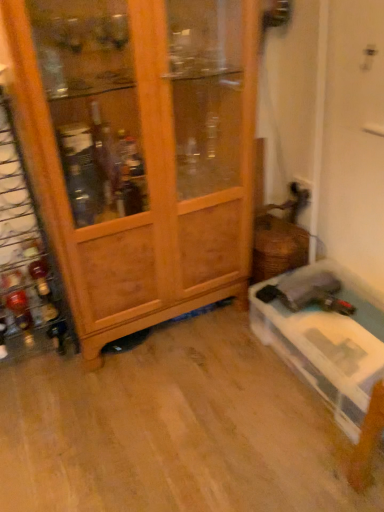
Question: Is wooden wine rack at left inside translucent glass bottle at left, the 1th bottle positioned from the bottom?

Choices:
 (A) no
 (B) yes

Answer: (A)

Question: Considering the relative sizes of translucent glass bottle at left, the 1th bottle positioned from the bottom, and wooden wine rack at left in the image provided, is translucent glass bottle at left, the 1th bottle positioned from the bottom, taller than wooden wine rack at left?

Choices:
 (A) no
 (B) yes

Answer: (A)

Question: From the image's perspective, is translucent glass bottle at left, the 1th bottle positioned from the bottom, under wooden wine rack at left?

Choices:
 (A) yes
 (B) no

Answer: (A)

Question: Is translucent glass bottle at left, the second bottle when ordered from top to bottom, oriented towards wooden wine rack at left?

Choices:
 (A) no
 (B) yes

Answer: (B)

Question: From a real-world perspective, is translucent glass bottle at left, the 1th bottle positioned from the bottom, beneath wooden wine rack at left?

Choices:
 (A) yes
 (B) no

Answer: (A)

Question: Does point (34, 246) appear closer or farther from the camera than point (4, 174)?

Choices:
 (A) farther
 (B) closer

Answer: (A)

Question: Is shiny amber glass bottle at left, which is the second bottle from bottom to top, in front of or behind wooden wine rack at left in the image?

Choices:
 (A) behind
 (B) front

Answer: (A)

Question: Looking at the image, does shiny amber glass bottle at left, which is the second bottle from bottom to top, seem bigger or smaller compared to wooden wine rack at left?

Choices:
 (A) small
 (B) big

Answer: (A)

Question: Is shiny amber glass bottle at left, which is the second bottle from bottom to top, wider or thinner than wooden wine rack at left?

Choices:
 (A) wide
 (B) thin

Answer: (A)

Question: Visually, is translucent glass bottle at left, the 1th bottle positioned from the bottom, positioned to the left or to the right of wooden cabinet at left?

Choices:
 (A) left
 (B) right

Answer: (A)

Question: From a real-world perspective, is translucent glass bottle at left, the second bottle when ordered from top to bottom, above or below wooden cabinet at left?

Choices:
 (A) below
 (B) above

Answer: (A)

Question: Based on their sizes in the image, would you say translucent glass bottle at left, the second bottle when ordered from top to bottom, is bigger or smaller than wooden cabinet at left?

Choices:
 (A) big
 (B) small

Answer: (B)

Question: Considering the positions of translucent glass bottle at left, the 1th bottle positioned from the bottom, and wooden cabinet at left in the image, is translucent glass bottle at left, the 1th bottle positioned from the bottom, taller or shorter than wooden cabinet at left?

Choices:
 (A) tall
 (B) short

Answer: (B)

Question: Considering the positions of translucent glass bottle at left, the second bottle when ordered from top to bottom, and shiny amber glass bottle at left, acting as the 1th bottle starting from the top, in the image, is translucent glass bottle at left, the second bottle when ordered from top to bottom, taller or shorter than shiny amber glass bottle at left, acting as the 1th bottle starting from the top,?

Choices:
 (A) tall
 (B) short

Answer: (A)

Question: Would you say translucent glass bottle at left, the 1th bottle positioned from the bottom, is to the left or to the right of shiny amber glass bottle at left, which is the second bottle from bottom to top, in the picture?

Choices:
 (A) left
 (B) right

Answer: (A)